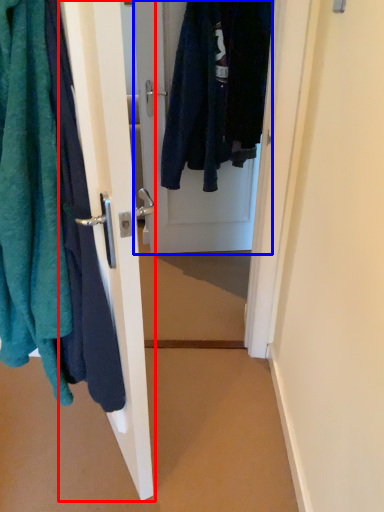
Question: Which of the following is the farthest to the observer, door (highlighted by a red box) or door (highlighted by a blue box)?

Choices:
 (A) door
 (B) door

Answer: (B)